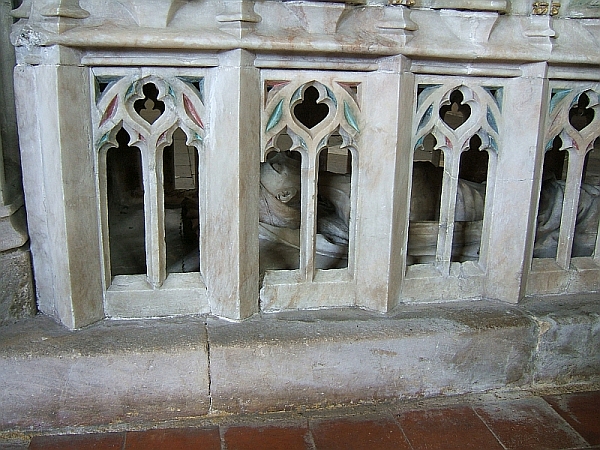
Identify the location of floor. (366, 434), (185, 157).